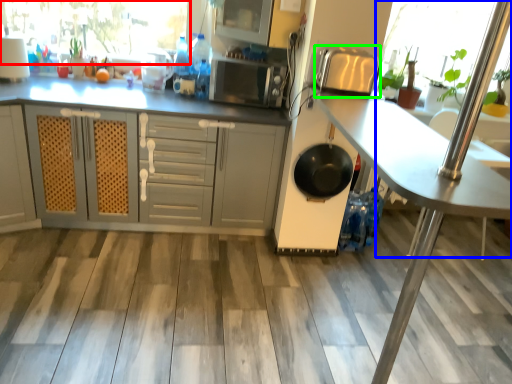
Question: Which object is the closest to the window screen (highlighted by a red box)? Choose among these: glass door (highlighted by a blue box) or appliance (highlighted by a green box).

Choices:
 (A) glass door
 (B) appliance

Answer: (B)